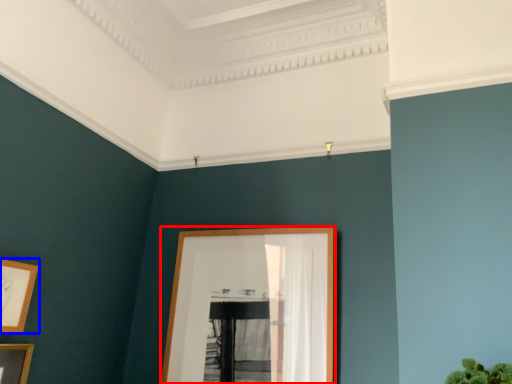
Question: Which object appears farthest to the camera in this image, picture frame (highlighted by a red box) or picture frame (highlighted by a blue box)?

Choices:
 (A) picture frame
 (B) picture frame

Answer: (A)